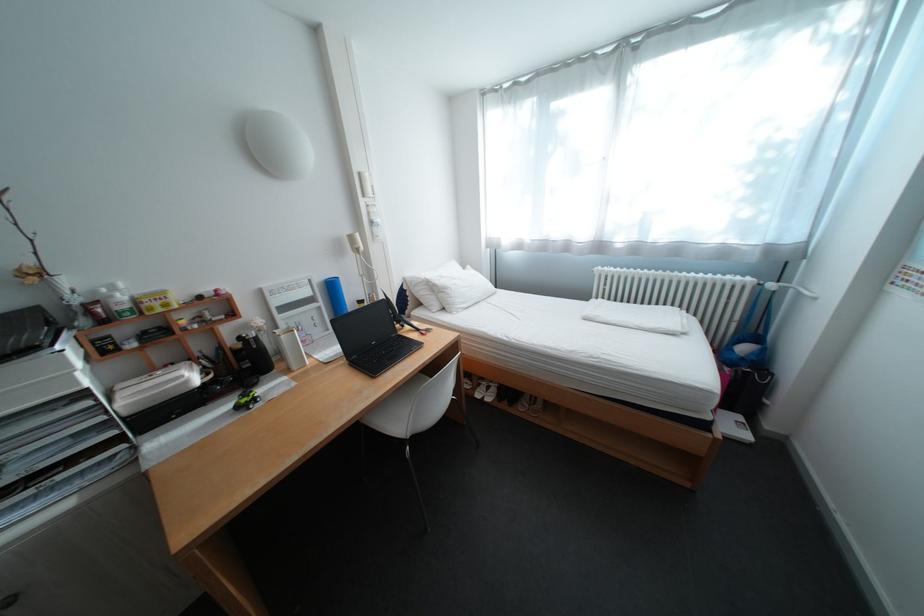
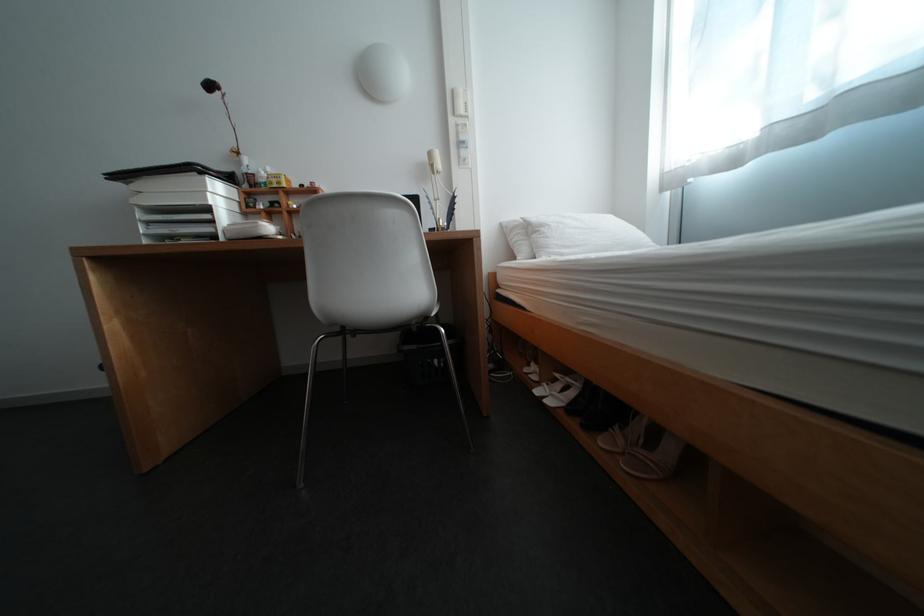
The point at (459, 290) is marked in the first image. Where is the corresponding point in the second image?

(555, 228)